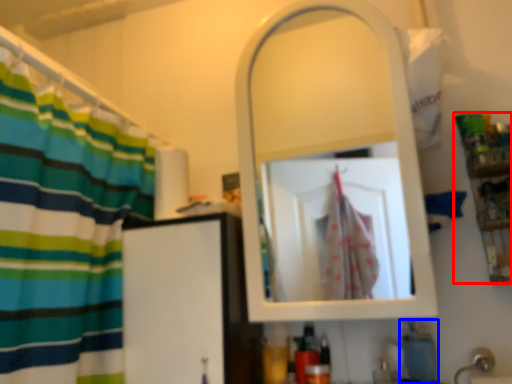
Question: Which object is further to the camera taking this photo, shelf (highlighted by a red box) or soap (highlighted by a blue box)?

Choices:
 (A) shelf
 (B) soap

Answer: (B)